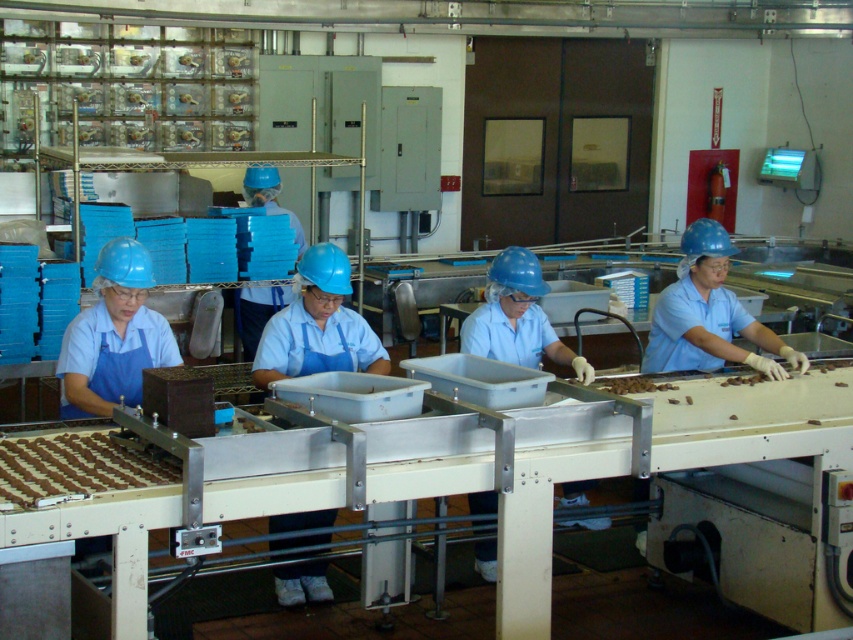
You are a maintenance worker in the factory and need to reach the light blue fabric at center to inspect it. The safety regulations state that you must stay at least 15 feet away from any moving machinery. Can you safely perform the inspection without violating the safety rules?

The light blue fabric at center is 14.78 feet from camera, which is less than the required 15 feet safety distance. Therefore, you cannot safely perform the inspection without violating the safety rules.

You are a quality inspector in the factory. You need to determine if the light blue fabric at center can fully cover the chocolate matte at lower left during packaging. Can it?

The light blue fabric at center has a larger size compared to chocolate matte at lower left, so yes, the light blue fabric at center can fully cover the chocolate matte at lower left during packaging.